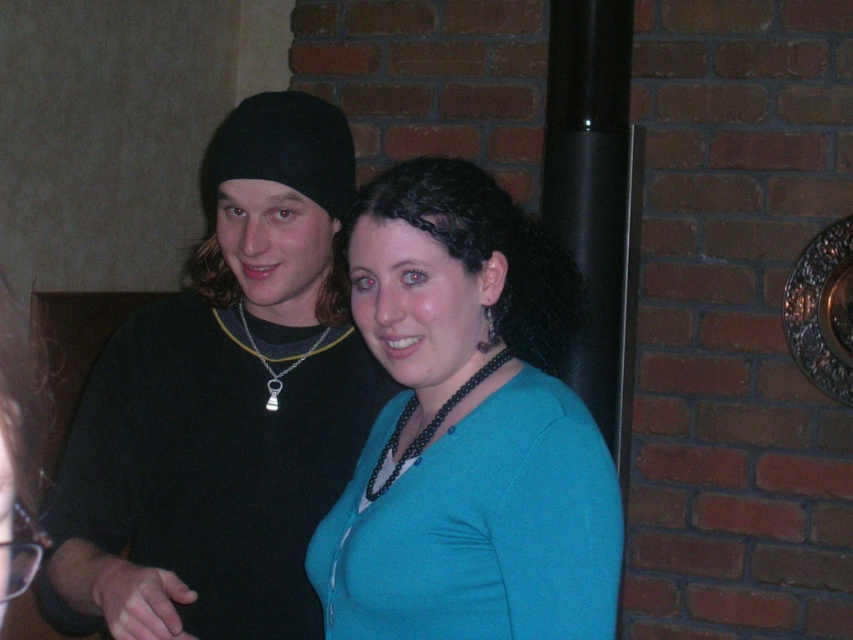
Question: Among these objects, which one is farthest from the camera?

Choices:
 (A) black matte beanie at left
 (B) silver metallic chain at center
 (C) black beaded necklace at center
 (D) teal matte cardigan at center

Answer: (B)

Question: Which point is farther from the camera taking this photo?

Choices:
 (A) (439, 422)
 (B) (469, 548)
 (C) (257, 504)

Answer: (C)

Question: Is teal matte cardigan at center smaller than silver metallic chain at center?

Choices:
 (A) no
 (B) yes

Answer: (A)

Question: Estimate the real-world distances between objects in this image. Which object is closer to the black beaded necklace at center?

Choices:
 (A) silver metallic chain at center
 (B) teal matte cardigan at center
 (C) black matte beanie at left

Answer: (B)

Question: Is black matte beanie at left behind silver metallic chain at center?

Choices:
 (A) no
 (B) yes

Answer: (A)

Question: Can you confirm if black matte beanie at left is thinner than teal matte cardigan at center?

Choices:
 (A) no
 (B) yes

Answer: (A)